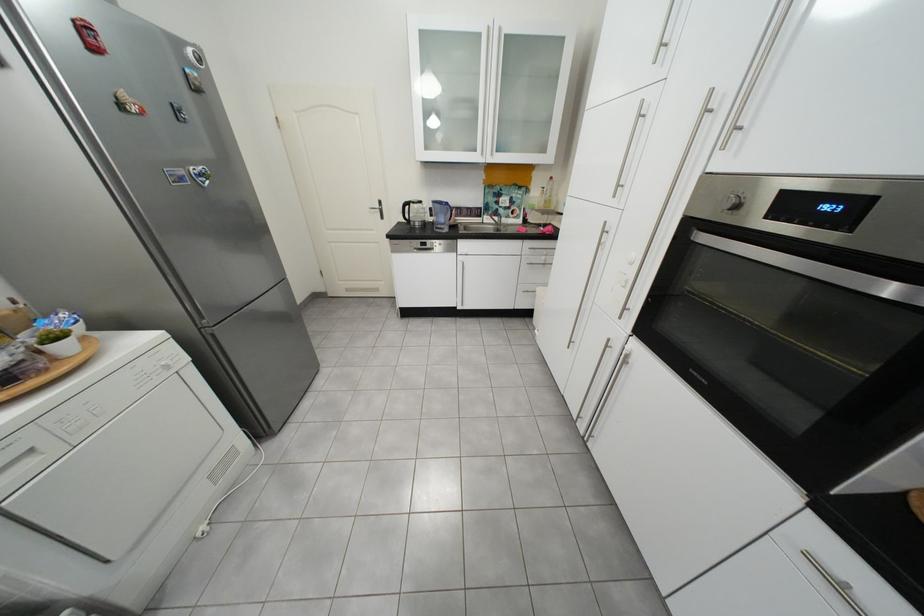
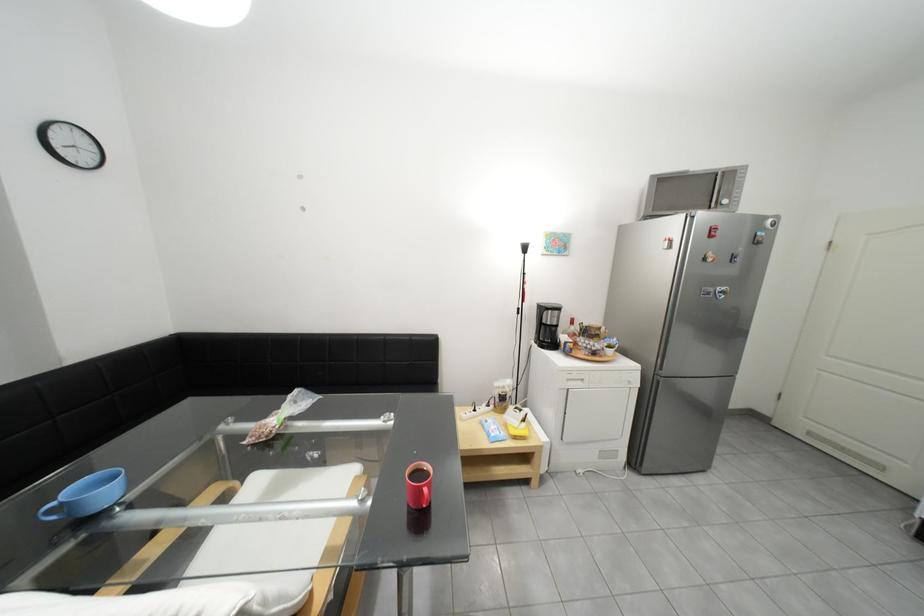
Question: The images are taken continuously from a first-person perspective. In which direction is your viewpoint rotating?

Choices:
 (A) Left
 (B) Right
 (C) Up
 (D) Down

Answer: (A)